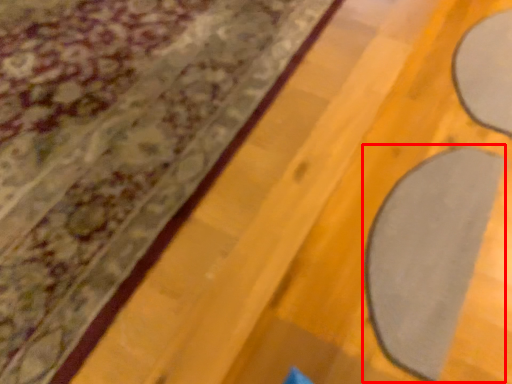
Question: From the image's perspective, where is yoga mat (annotated by the red box) located relative to curtain?

Choices:
 (A) below
 (B) above

Answer: (A)